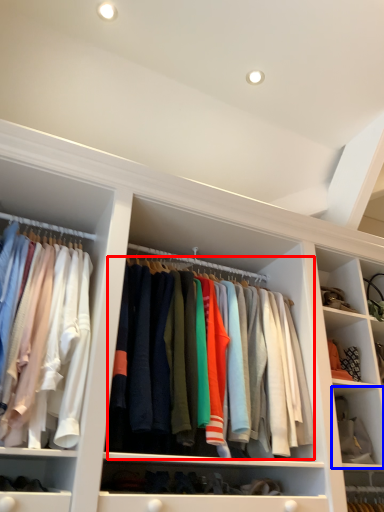
Question: Which object is further to the camera taking this photo, clothing (highlighted by a red box) or cabinet (highlighted by a blue box)?

Choices:
 (A) clothing
 (B) cabinet

Answer: (B)